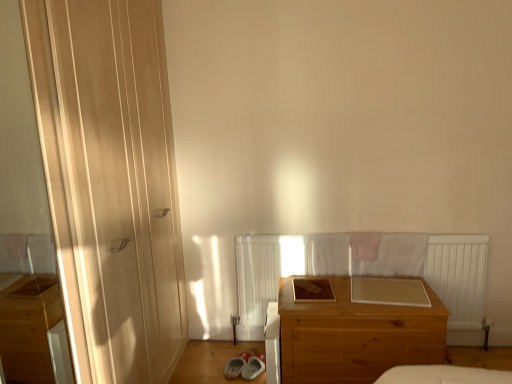
Question: Is transparent glass screen door at left bigger than wooden chest of drawers at center?

Choices:
 (A) yes
 (B) no

Answer: (B)

Question: Is transparent glass screen door at left far from wooden chest of drawers at center?

Choices:
 (A) no
 (B) yes

Answer: (B)

Question: From a real-world perspective, is transparent glass screen door at left physically above wooden chest of drawers at center?

Choices:
 (A) yes
 (B) no

Answer: (A)

Question: Is transparent glass screen door at left located outside wooden chest of drawers at center?

Choices:
 (A) no
 (B) yes

Answer: (B)

Question: Is transparent glass screen door at left positioned in front of wooden chest of drawers at center?

Choices:
 (A) yes
 (B) no

Answer: (A)

Question: Does transparent glass screen door at left have a lesser height compared to wooden chest of drawers at center?

Choices:
 (A) no
 (B) yes

Answer: (A)

Question: Is matte wood door at left wider than transparent glass screen door at left?

Choices:
 (A) no
 (B) yes

Answer: (B)

Question: Does matte wood door at left have a larger size compared to transparent glass screen door at left?

Choices:
 (A) yes
 (B) no

Answer: (A)

Question: Is matte wood door at left not near transparent glass screen door at left?

Choices:
 (A) no
 (B) yes

Answer: (B)

Question: Is matte wood door at left outside transparent glass screen door at left?

Choices:
 (A) yes
 (B) no

Answer: (A)

Question: Is matte wood door at left positioned with its back to transparent glass screen door at left?

Choices:
 (A) yes
 (B) no

Answer: (B)

Question: From the image's perspective, is matte wood door at left above transparent glass screen door at left?

Choices:
 (A) yes
 (B) no

Answer: (A)

Question: Does transparent glass screen door at left have a lesser height compared to matte wood door at left?

Choices:
 (A) yes
 (B) no

Answer: (A)